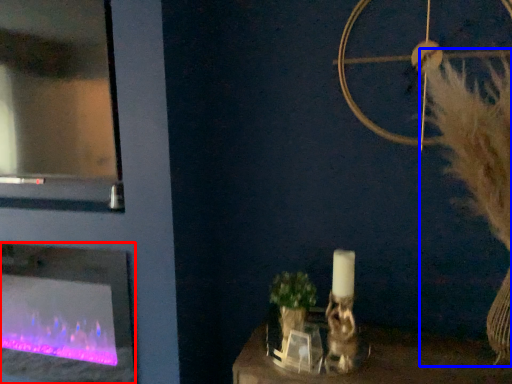
Question: Which point is closer to the camera, fireplace (highlighted by a red box) or fur (highlighted by a blue box)?

Choices:
 (A) fireplace
 (B) fur

Answer: (B)